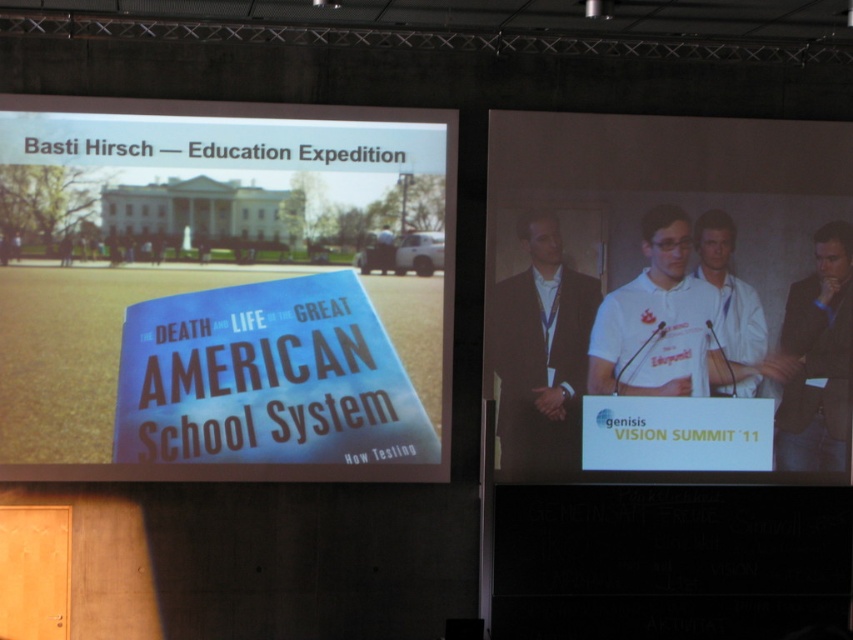
Does blue paper sign at upper left appear on the left side of white glossy podium at center?

Yes, blue paper sign at upper left is to the left of white glossy podium at center.

Between blue paper sign at upper left and white glossy podium at center, which one is positioned lower?

white glossy podium at center is below.

Does point (173, 346) lie in front of point (573, 200)?

Yes, point (173, 346) is in front of point (573, 200).

This screenshot has height=640, width=853. I want to click on blue paper sign at upper left, so click(x=221, y=291).

Is point (556, 321) closer to camera compared to point (827, 396)?

Yes, it is in front of point (827, 396).

Where is `dark brown suit at center`? Image resolution: width=853 pixels, height=640 pixels. dark brown suit at center is located at coordinates (541, 353).

Who is more forward, (368, 131) or (573, 460)?

Point (368, 131)

Find the location of a particular element. Image resolution: width=853 pixels, height=640 pixels. blue paper sign at upper left is located at coordinates (221, 291).